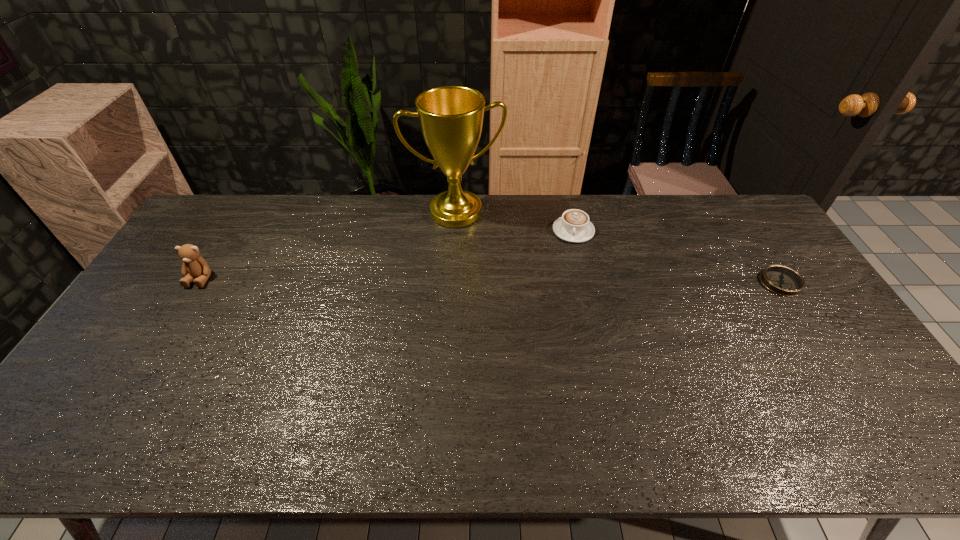
Where is `vacant space positioned with the handle on the right side of the cappuccino`? The height and width of the screenshot is (540, 960). vacant space positioned with the handle on the right side of the cappuccino is located at coordinates (577, 305).

This screenshot has width=960, height=540. What are the coordinates of `free space located 0.370m with the handle on the right side of the cappuccino` in the screenshot? It's located at (579, 332).

The height and width of the screenshot is (540, 960). In order to click on free location located 0.300m with the handle on the right side of the cappuccino in this screenshot , I will do `click(578, 313)`.

Locate an element on the screen. The height and width of the screenshot is (540, 960). vacant space situated by the handles of the tallest object is located at coordinates coord(473,264).

Find the location of a particular element. The width and height of the screenshot is (960, 540). free point located 0.310m by the handles of the tallest object is located at coordinates (482, 295).

Locate an element on the screen. This screenshot has height=540, width=960. free space located by the handles of the tallest object is located at coordinates (472, 257).

Locate an element on the screen. cappuccino that is at the far edge is located at coordinates (574, 226).

Locate an element on the screen. Image resolution: width=960 pixels, height=540 pixels. award present at the far edge is located at coordinates (451, 117).

The image size is (960, 540). What are the coordinates of `object situated at the left edge` in the screenshot? It's located at (194, 265).

You are a GUI agent. You are given a task and a screenshot of the screen. Output one action in this format:
    pyautogui.click(x=<x>, y=<y>)
    Task: Click on the object that is positioned at the right edge
    Image resolution: width=960 pixels, height=540 pixels.
    Given the screenshot: What is the action you would take?
    pyautogui.click(x=784, y=281)